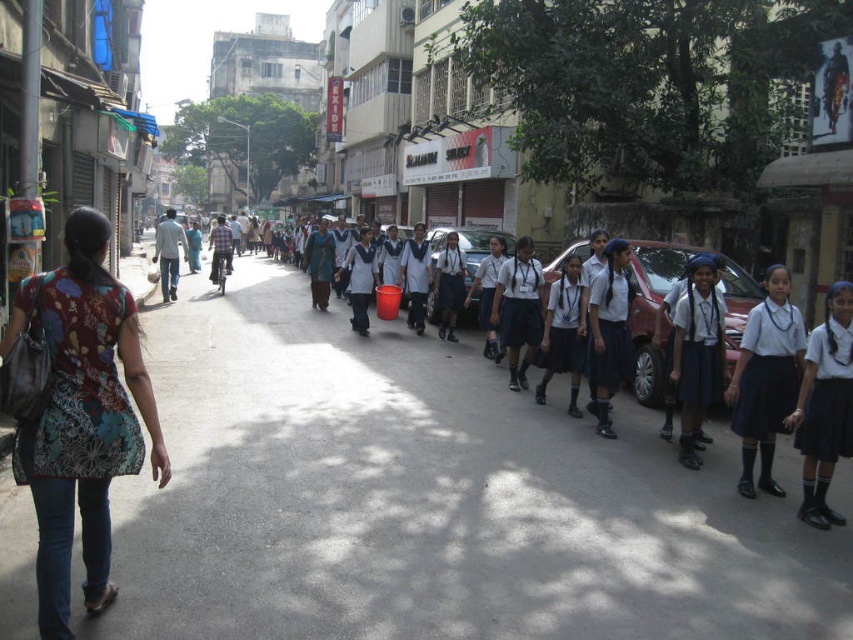
You are a delivery person who needs to pass through the street in the image. There are white uniform students at center and a blue fabric dress at center. What is the minimum width of the street at the point where you need to pass?

The minimum width of the street at the point where you need to pass is 26.57 feet, as this is the distance between the white uniform students at center and the blue fabric dress at center.

You are a delivery person trying to navigate through the street scene. You need to deliver a package to the point at coordinates [451,428]. However, there are schoolchildren walking in formation near point [326,284]. Which point should you avoid to ensure you don not block their path?

You should avoid the point at [326,284] because it is behind the delivery point at [451,428]. Since the schoolchildren are near the point at [326,284], staying away from that area will prevent blocking their path.